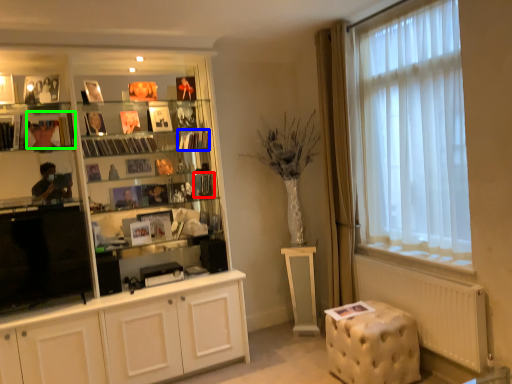
Question: Based on their relative distances, which object is nearer to book (highlighted by a red box)? Choose from book (highlighted by a blue box) and book (highlighted by a green box).

Choices:
 (A) book
 (B) book

Answer: (A)